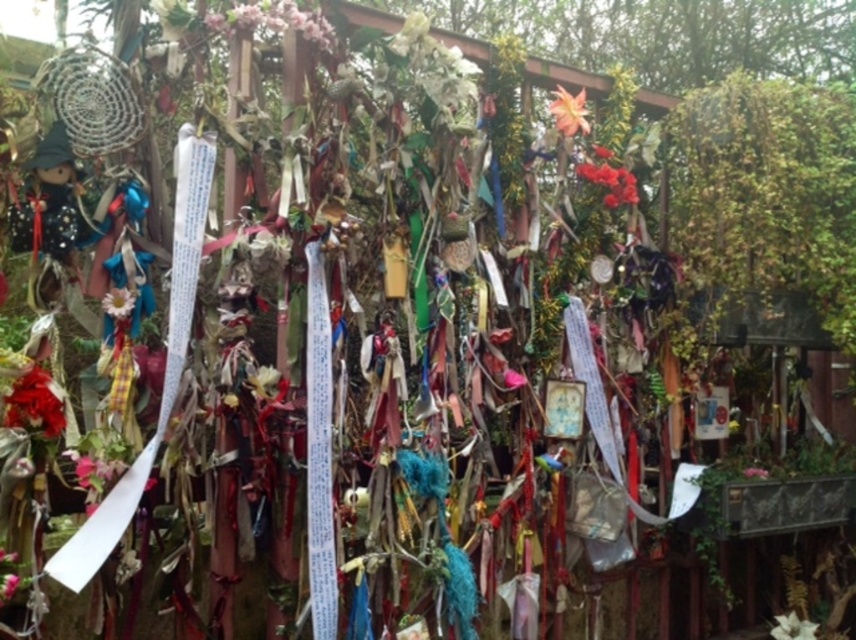
Question: From the image, what is the correct spatial relationship of matte red flower at lower left in relation to vivid red petals at center?

Choices:
 (A) above
 (B) below

Answer: (B)

Question: Based on their relative distances, which object is farther from the white matte flower at center?

Choices:
 (A) vivid red petals at center
 (B) matte red flower at lower left

Answer: (B)

Question: Is vivid red petals at center bigger than white matte flower at center?

Choices:
 (A) no
 (B) yes

Answer: (B)

Question: Among these objects, which one is farthest from the camera?

Choices:
 (A) white paper flower at center
 (B) orange matte flower at upper center
 (C) matte red flower at lower left
 (D) white matte flower at center

Answer: (D)

Question: Is matte red flower at lower left above white matte flower at center?

Choices:
 (A) yes
 (B) no

Answer: (A)

Question: Which point appears farthest from the camera in this image?

Choices:
 (A) (254, 19)
 (B) (762, 472)
 (C) (795, 620)

Answer: (C)